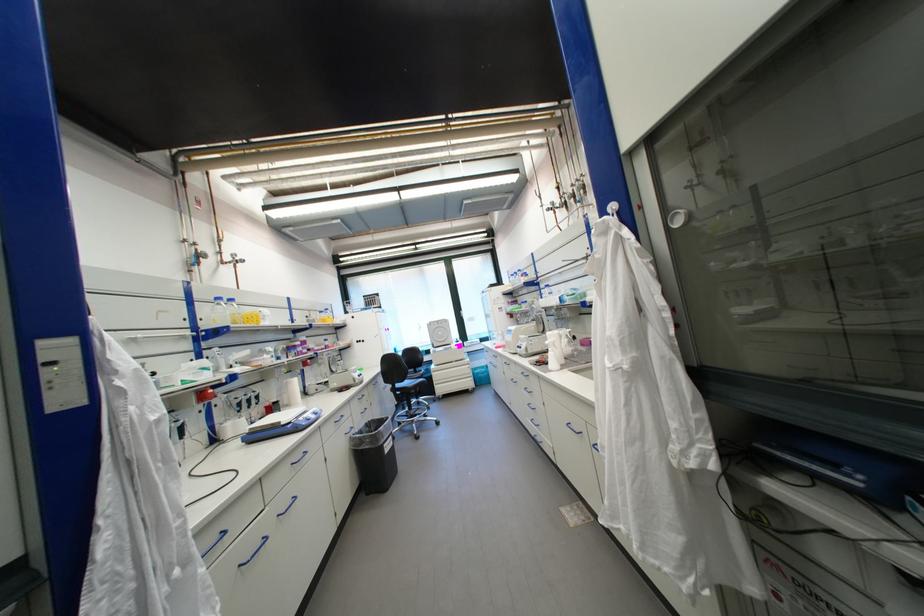
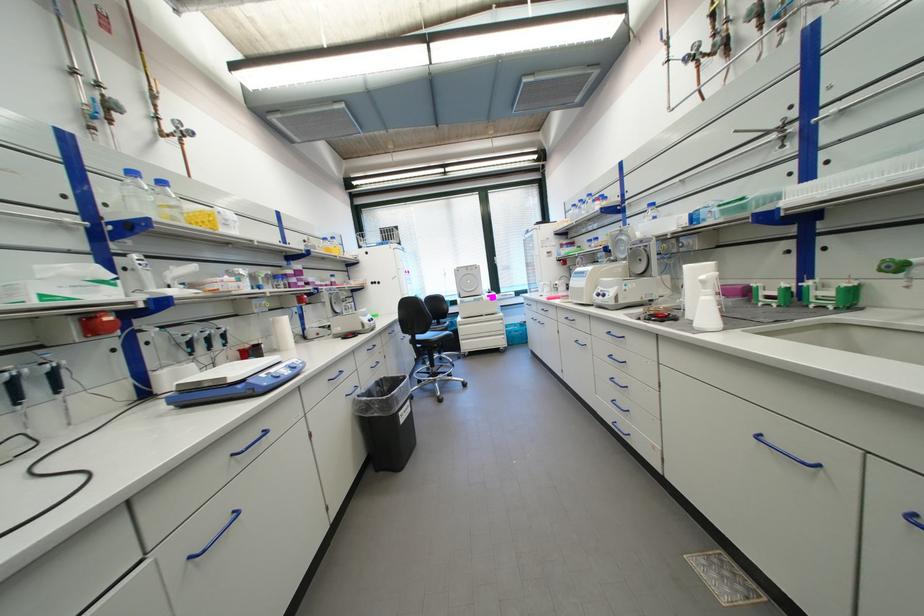
Question: How did the camera likely rotate?

Choices:
 (A) Left
 (B) Right
 (C) Up
 (D) Down

Answer: (D)